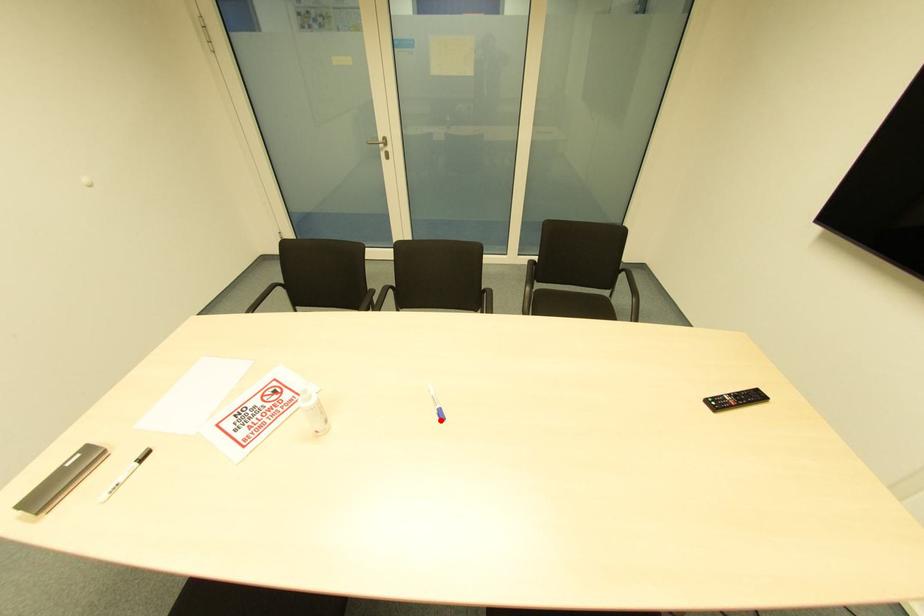
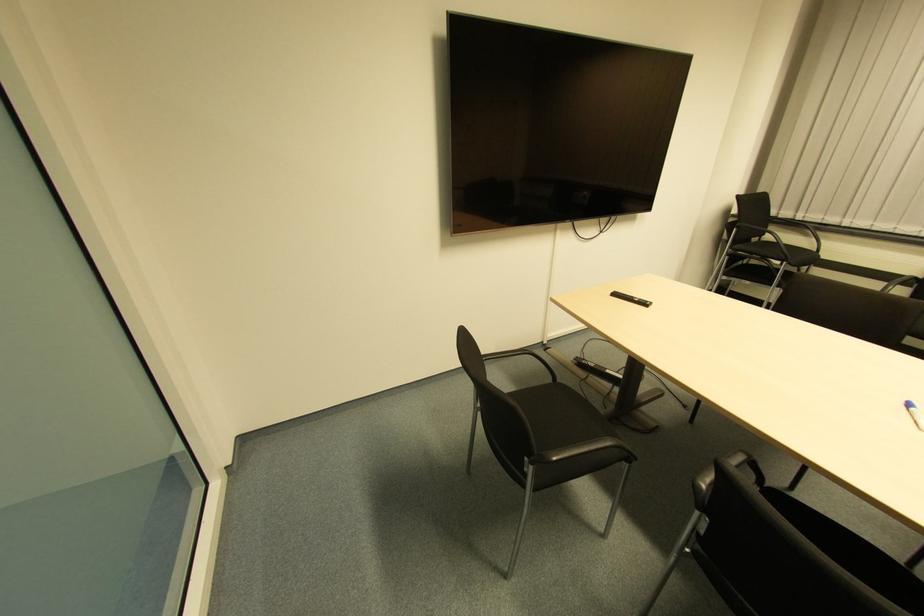
Locate, in the second image, the point that corresponds to the highlighted location in the first image.

(907, 408)